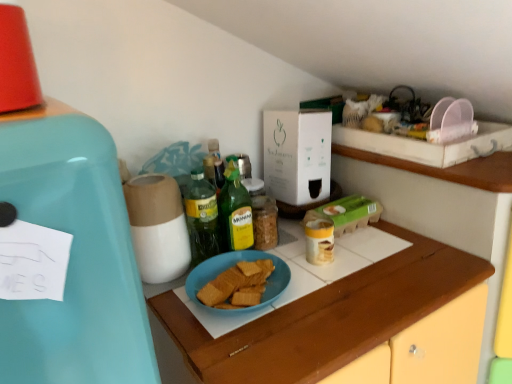
At what (x,y) coordinates should I click in order to perform the action: click on unoccupied area in front of blue matte plate at center. Please return your answer as a coordinate pair (x, y). Looking at the image, I should click on (239, 319).